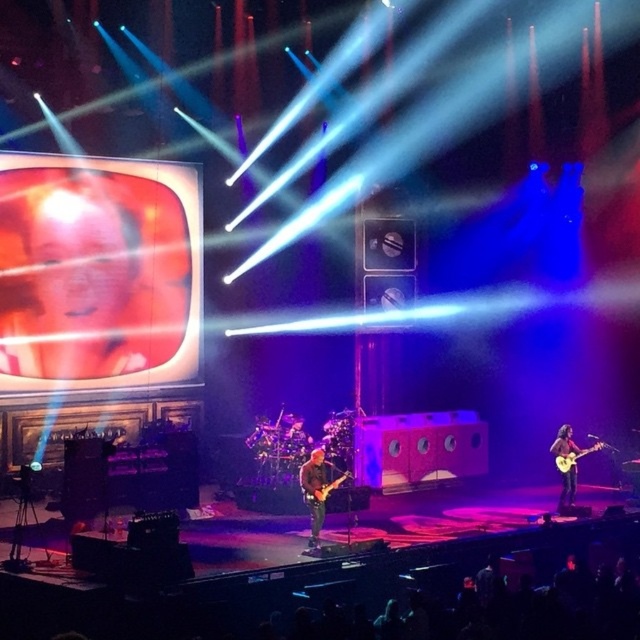
Does light brown wooden guitar at right appear on the left side of glossy electric guitar at center?

No, light brown wooden guitar at right is not to the left of glossy electric guitar at center.

Who is more distant from viewer, (596,449) or (348,476)?

The point (348,476) is more distant.

Which is in front, point (604, 442) or point (328, 492)?

Point (328, 492) is in front.

Locate an element on the screen. light brown wooden guitar at right is located at coordinates (573, 458).

The height and width of the screenshot is (640, 640). Describe the element at coordinates (317, 490) in the screenshot. I see `shiny black guitar at center` at that location.

Is point (308, 461) closer to camera compared to point (577, 468)?

Yes, it is in front of point (577, 468).

Is point (337, 476) in front of point (570, 467)?

No.

Find the location of a particular element. shiny black guitar at center is located at coordinates (317, 490).

Between point (312, 531) and point (324, 497), which one is positioned in front?

Positioned in front is point (324, 497).

Is point (314, 547) in front of point (314, 486)?

That is True.

You are a GUI agent. You are given a task and a screenshot of the screen. Output one action in this format:
    pyautogui.click(x=<x>, y=<y>)
    Task: Click on the shiny black guitar at center
    This screenshot has width=640, height=640.
    Given the screenshot: What is the action you would take?
    pyautogui.click(x=317, y=490)

The width and height of the screenshot is (640, 640). Find the location of `shiny black guitar at center`. shiny black guitar at center is located at coordinates (317, 490).